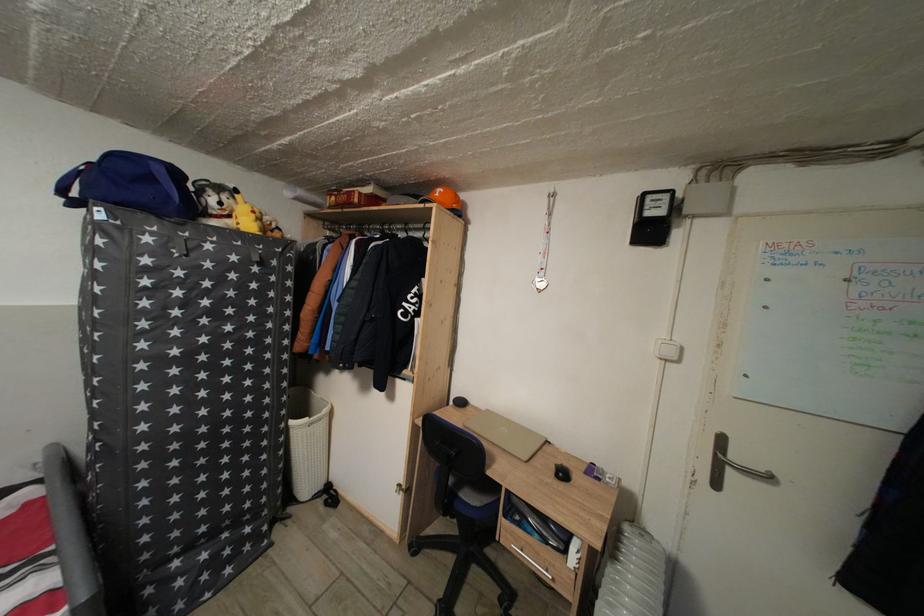
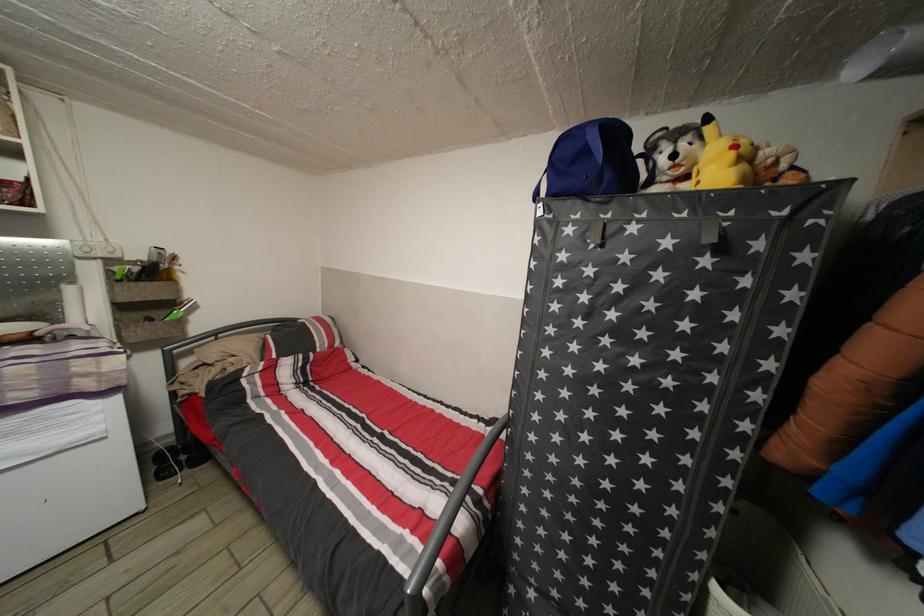
In the second image, find the point that corresponds to the point at 261,223 in the first image.

(738, 161)